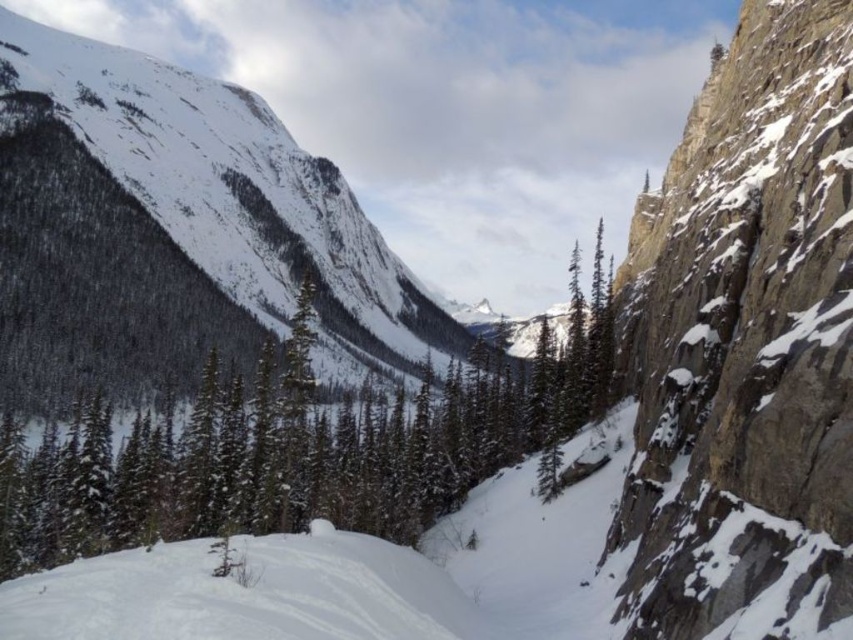
Between snowy rock mountain at upper left and green textured pine tree at center, which one has more height?

With more height is snowy rock mountain at upper left.

Who is positioned more to the right, snowy rock mountain at upper left or green textured pine tree at center?

From the viewer's perspective, green textured pine tree at center appears more on the right side.

Is point (183, 131) farther from camera compared to point (171, 417)?

That is True.

Find the location of `snowy rock mountain at upper left`. snowy rock mountain at upper left is located at coordinates (177, 234).

Can you confirm if rocky cliff at right is smaller than snowy rock mountain at upper left?

Correct, rocky cliff at right occupies less space than snowy rock mountain at upper left.

You are a GUI agent. You are given a task and a screenshot of the screen. Output one action in this format:
    pyautogui.click(x=<x>, y=<y>)
    Task: Click on the rocky cliff at right
    The height and width of the screenshot is (640, 853).
    Given the screenshot: What is the action you would take?
    pyautogui.click(x=746, y=348)

Where is `rocky cliff at right`? rocky cliff at right is located at coordinates (746, 348).

Does rocky cliff at right appear over white snow ski slope at lower left?

Yes.

Which is below, rocky cliff at right or white snow ski slope at lower left?

white snow ski slope at lower left

Image resolution: width=853 pixels, height=640 pixels. In order to click on rocky cliff at right in this screenshot , I will do `click(746, 348)`.